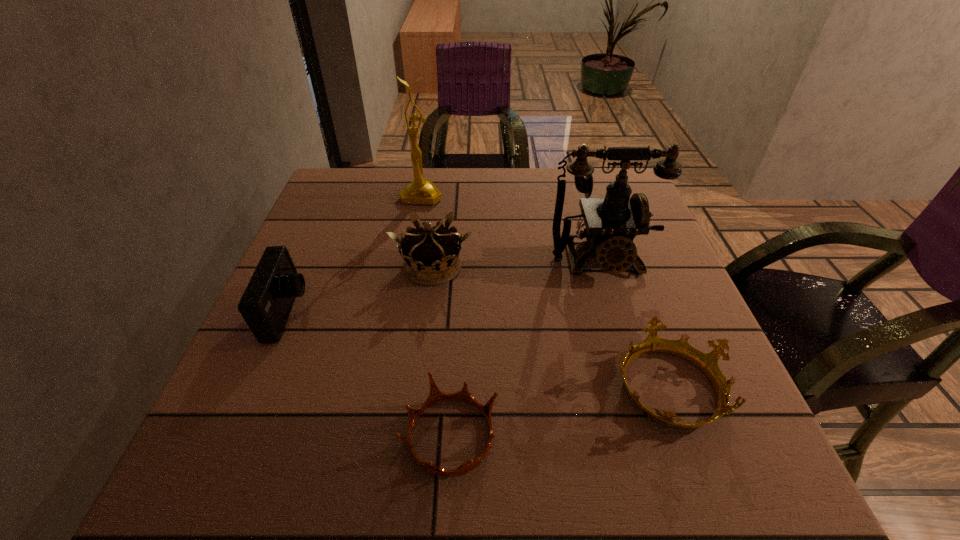
Image resolution: width=960 pixels, height=540 pixels. What are the coordinates of `vacant area at the near right corner` in the screenshot? It's located at (765, 480).

Image resolution: width=960 pixels, height=540 pixels. Find the location of `free area in between the farthest crown and the rightmost crown`. free area in between the farthest crown and the rightmost crown is located at coordinates (550, 326).

This screenshot has width=960, height=540. In order to click on vacant space that's between the telephone and the leftmost object in this screenshot , I will do `click(444, 287)`.

At what (x,y) coordinates should I click in order to perform the action: click on empty location between the award and the rightmost crown. Please return your answer as a coordinate pair (x, y). Looking at the image, I should click on (544, 291).

The width and height of the screenshot is (960, 540). I want to click on free point between the rightmost crown and the telephone, so click(634, 324).

Locate an element on the screen. vacant area that lies between the award and the rightmost crown is located at coordinates (544, 291).

The height and width of the screenshot is (540, 960). In order to click on object that is the second closest to the farthest crown in this screenshot , I will do `click(420, 191)`.

Select which object is the third closest to the leftmost object. Please provide its 2D coordinates. Your answer should be formatted as a tuple, i.e. [(x, y)], where the tuple contains the x and y coordinates of a point satisfying the conditions above.

[(420, 191)]

Identify which crown is located as the second nearest to the telephone. Please provide its 2D coordinates. Your answer should be formatted as a tuple, i.e. [(x, y)], where the tuple contains the x and y coordinates of a point satisfying the conditions above.

[(431, 255)]

At what (x,y) coordinates should I click in order to perform the action: click on the second closest crown to the tallest crown. Please return your answer as a coordinate pair (x, y). The image size is (960, 540). Looking at the image, I should click on (707, 362).